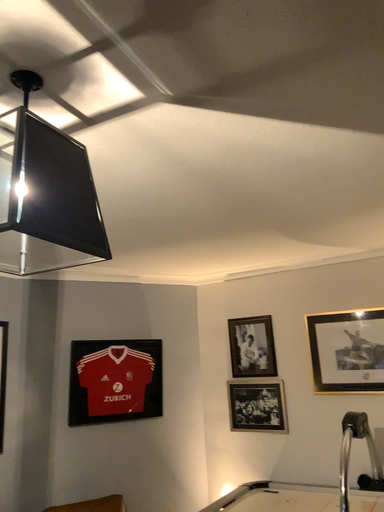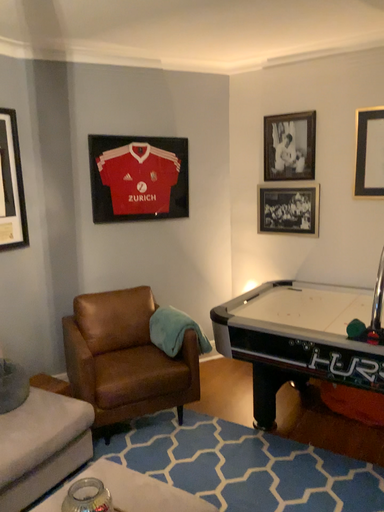
Question: How did the camera likely rotate when shooting the video?

Choices:
 (A) rotated upward
 (B) rotated downward

Answer: (B)